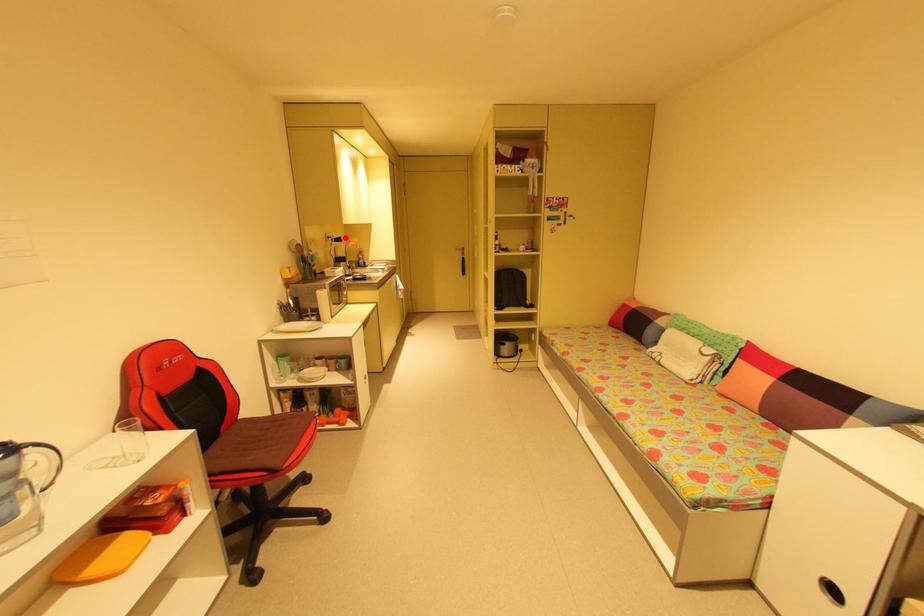
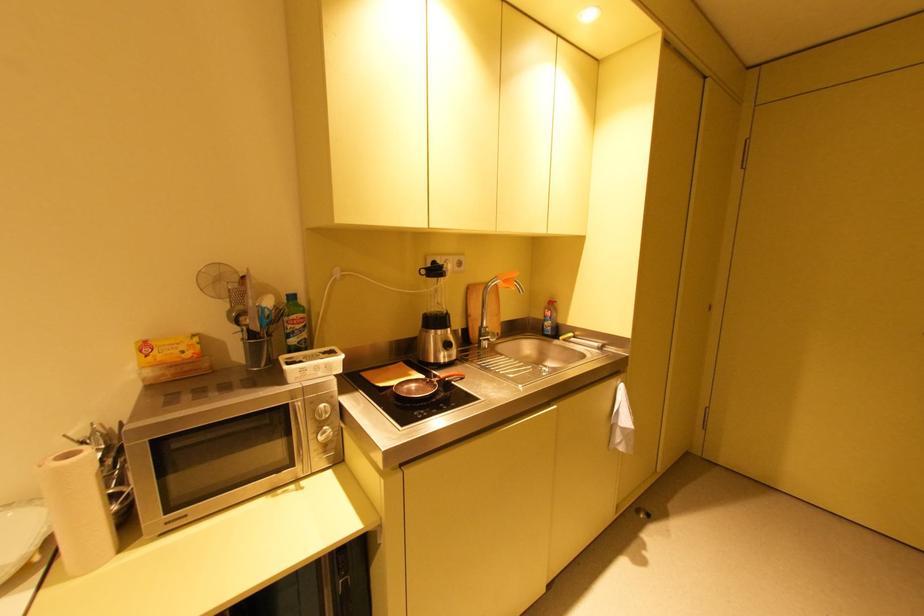
Find the pixel in the second image that matches the highlighted location in the first image.

(444, 267)